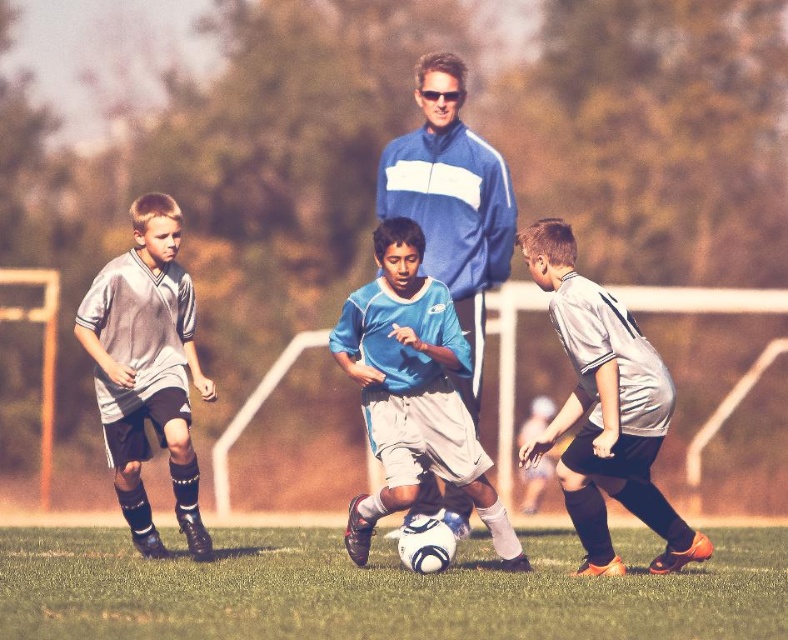
You are a soccer coach analyzing the game. You notice the blue matte soccer ball at center and the gray matte jersey at right. Based on their positions, which object is closer to the camera?

The blue matte soccer ball at center is closer to the camera than the gray matte jersey at right because it is wider and appears larger in the frame.

You are a soccer coach observing the game. You need to quickly assess the ball position relative to the players. Is the white matte soccer ball at center located to the left or right of the gray matte jersey at right?

The white matte soccer ball at center is to the left of the gray matte jersey at right.

You are a soccer coach analyzing the game. The ball is at point (411, 392). The field is divided into three zones. The first zone is from 0 to 0.333, the second from 0.333 to 0.666, and the third from 0.666 to 1.0. In which zone is the ball located?

The ball is located in the third zone because its coordinate is 0.613, which falls between 0.666 and 1.0.